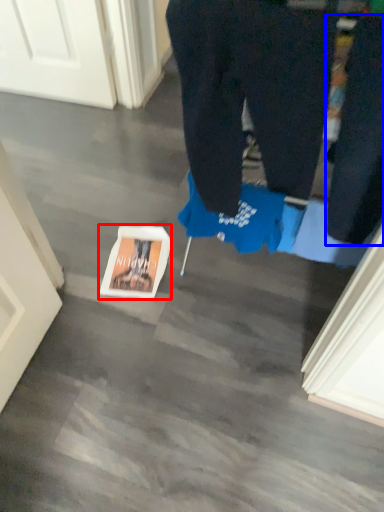
Question: Which of the following is the closest to the observer, copy (highlighted by a red box) or pants (highlighted by a blue box)?

Choices:
 (A) copy
 (B) pants

Answer: (B)